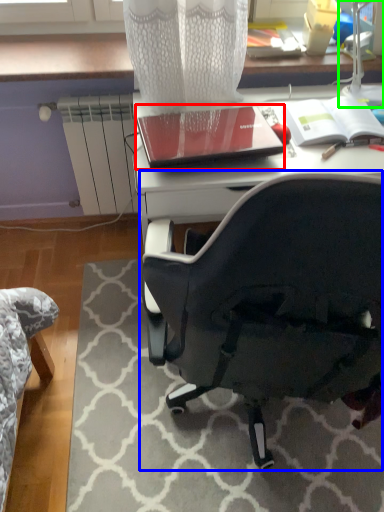
Question: Estimate the real-world distances between objects in this image. Which object is closer to notebook (highlighted by a red box), chair (highlighted by a blue box) or table lamp (highlighted by a green box)?

Choices:
 (A) chair
 (B) table lamp

Answer: (B)